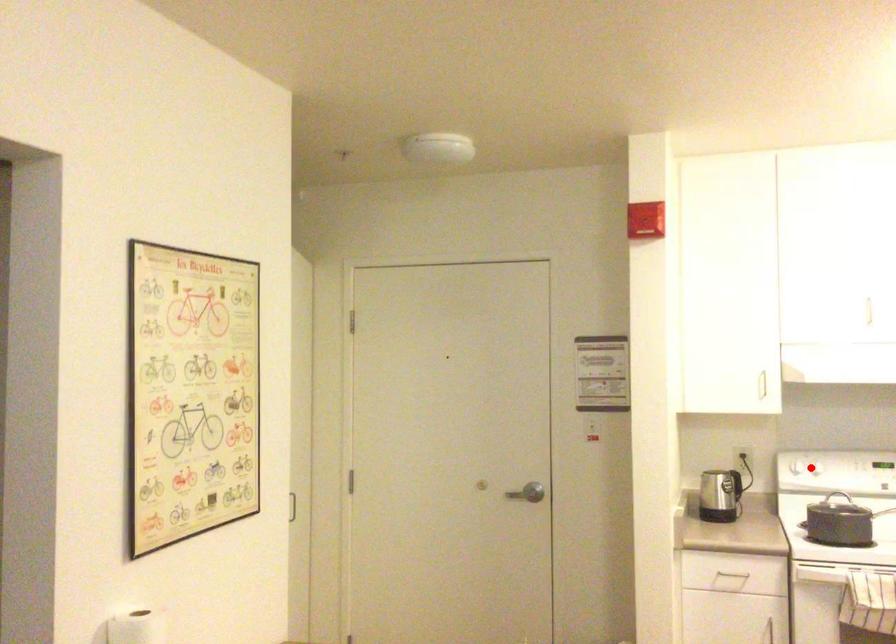
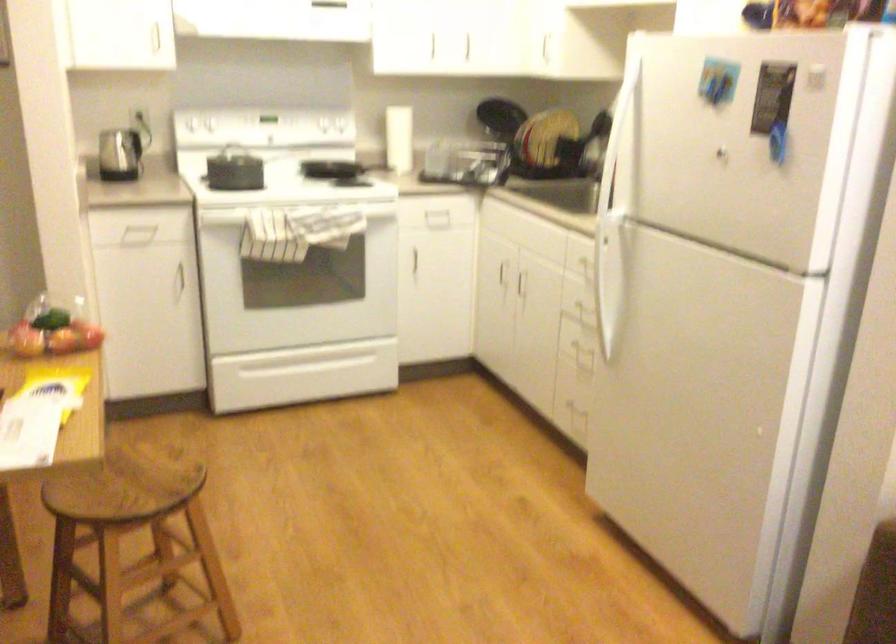
Question: I am providing you with two images of the same scene from different viewpoints. Image1 has a red point marked. In image2, the corresponding 3D location appears at what relative position? Reply with the corresponding letter.

Choices:
 (A) Closer
 (B) Farther

Answer: (B)